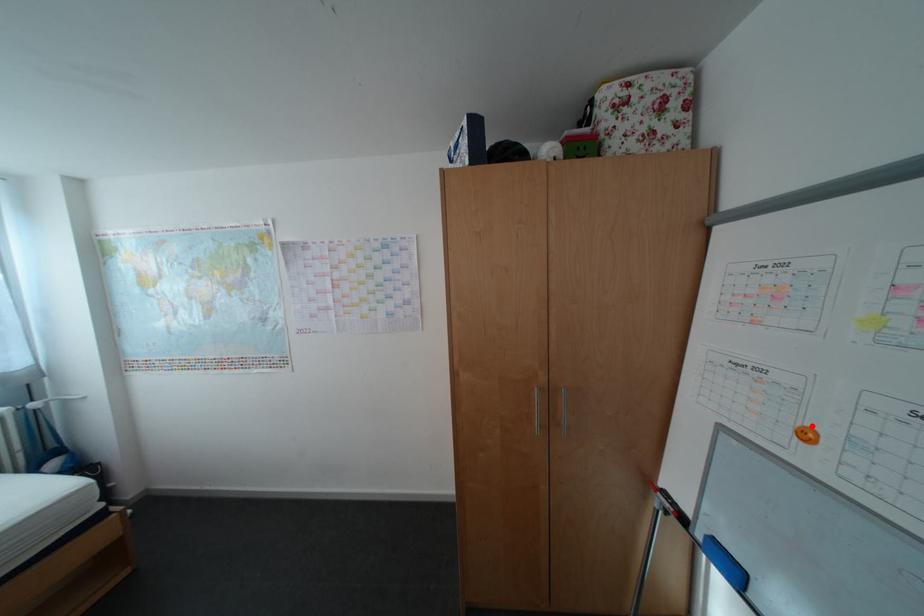
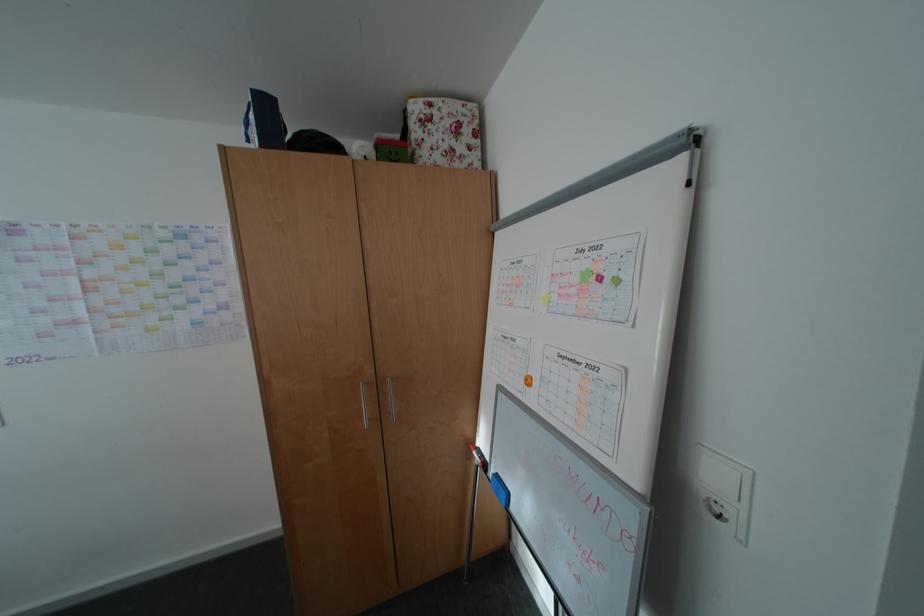
In the second image, find the point that corresponds to the highlighted location in the first image.

(539, 376)